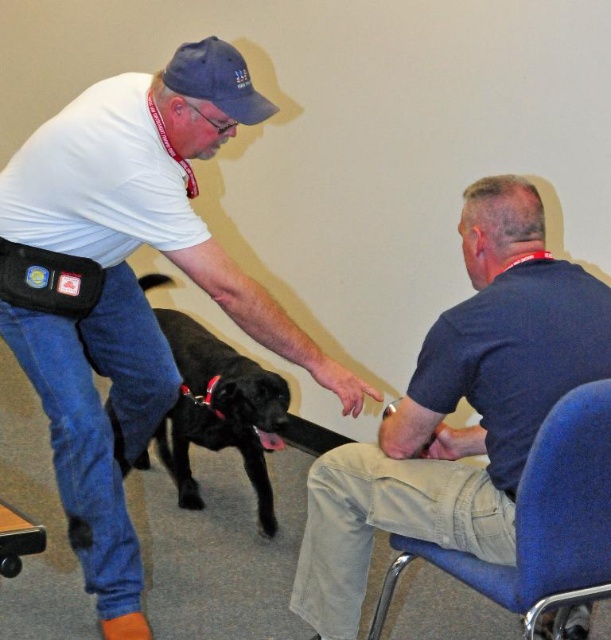
Based on the photo, does dark blue shirt at right lie behind black leather dog at center?

No, dark blue shirt at right is in front of black leather dog at center.

Which is behind, point (337, 624) or point (159, 310)?

Point (159, 310)

You are a GUI agent. You are given a task and a screenshot of the screen. Output one action in this format:
    pyautogui.click(x=<x>, y=<y>)
    Task: Click on the dark blue shirt at right
    This screenshot has width=611, height=640.
    Given the screenshot: What is the action you would take?
    pyautogui.click(x=455, y=408)

Between blue fabric chair at lower right and wooden stool at lower left, which one appears on the right side from the viewer's perspective?

blue fabric chair at lower right is more to the right.

Who is higher up, blue fabric chair at lower right or wooden stool at lower left?

Positioned higher is wooden stool at lower left.

You are a GUI agent. You are given a task and a screenshot of the screen. Output one action in this format:
    pyautogui.click(x=<x>, y=<y>)
    Task: Click on the blue fabric chair at lower right
    The image size is (611, 640).
    Given the screenshot: What is the action you would take?
    pyautogui.click(x=541, y=522)

Which is more to the right, dark blue shirt at right or wooden stool at lower left?

Positioned to the right is dark blue shirt at right.

Locate an element on the screen. The image size is (611, 640). dark blue shirt at right is located at coordinates (455, 408).